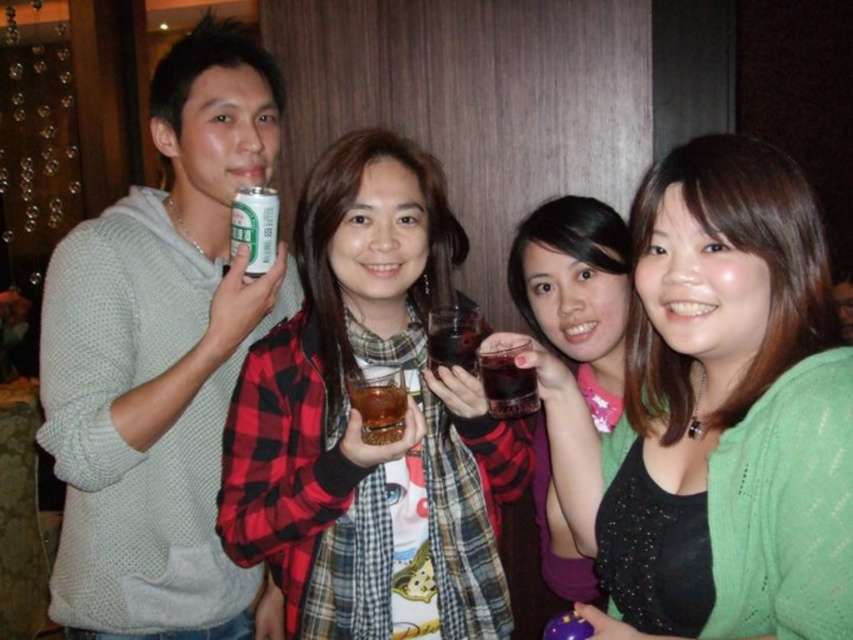
You are standing in the room and want to reach the point marked as point (260, 122). If you take a step forward of 1 meter, will you be closer to or farther from the point?

The point (260, 122) is 1.42 meters away from the viewer. If you take a step forward of 1 meter, you will be 0.42 meters away from the point, which is closer.

You are a bartender preparing drinks for a party. You need to place a matte black glass at center and a translucent glass cup at center on a shelf. The shelf has a maximum width of 20 inches. Can both items fit side by side without overlapping?

The distance between the matte black glass at center and the translucent glass cup at center is 24.13 inches. Since the shelf is only 20 inches wide, they cannot fit side by side without overlapping.